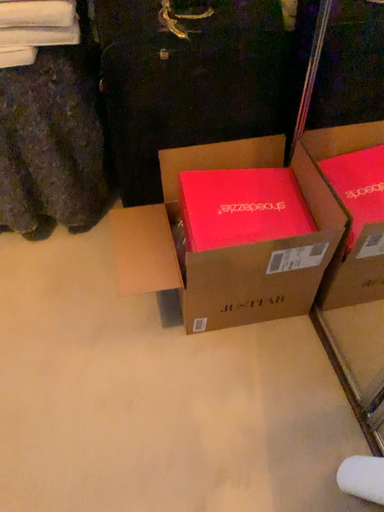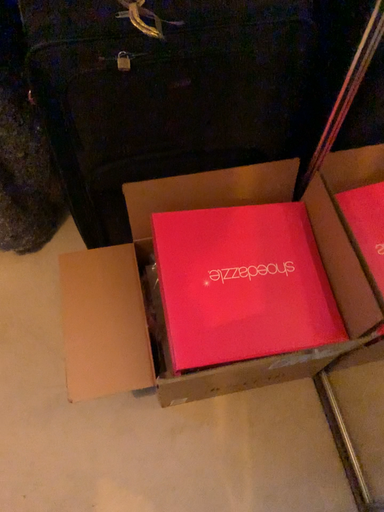
Question: Which way did the camera rotate in the video?

Choices:
 (A) rotated upward
 (B) rotated downward

Answer: (B)